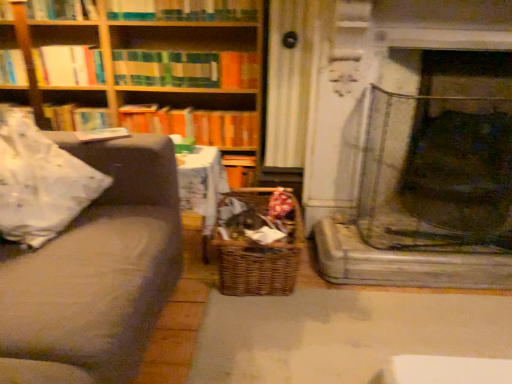
Question: From the image's perspective, is wooden bookshelf at upper left located above or below woven brown basket at center?

Choices:
 (A) above
 (B) below

Answer: (A)

Question: In the image, is wooden bookshelf at upper left positioned in front of or behind woven brown basket at center?

Choices:
 (A) front
 (B) behind

Answer: (B)

Question: Estimate the real-world distances between objects in this image. Which object is closer to the hardcover book at upper center, the second book in the top-to-bottom sequence?

Choices:
 (A) striped fabric book at upper center, the third book when ordered from top to bottom
 (B) woodenmaterial/texturebookcase at upper left
 (C) orange matte book at center, the 5th book in the top-to-bottom sequence
 (D) woven brown basket at center
 (E) hardcover book at upper left, positioned as the fourth book in top-to-bottom order

Answer: (A)

Question: Which object is the closest to the hardcover book at upper left, positioned as the fourth book in top-to-bottom order?

Choices:
 (A) striped fabric book at upper center, the third book when ordered from top to bottom
 (B) woven brown basket at center
 (C) orange matte book at center, the 5th book in the top-to-bottom sequence
 (D) hardcover book at upper center, the second book in the top-to-bottom sequence
 (E) woodenmaterial/texturebookcase at upper left

Answer: (C)